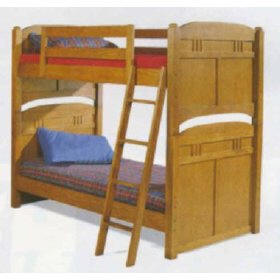
Where is `lower bed frame`? The image size is (280, 280). lower bed frame is located at coordinates (64, 196).